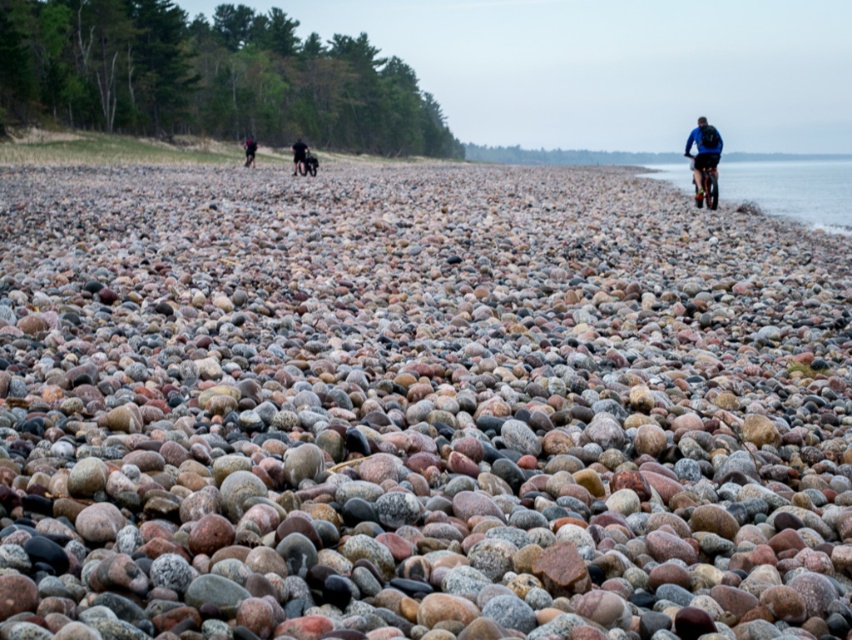
Question: Based on their relative distances, which object is farther from the speckled rock at center?

Choices:
 (A) blue fabric jacket at right
 (B) black fabric pants at center
 (C) dark blue fabric jacket at center

Answer: (B)

Question: Can you confirm if dark blue fabric jacket at center is positioned to the right of black fabric pants at center?

Choices:
 (A) no
 (B) yes

Answer: (B)

Question: Which object is the closest to the speckled rock at center?

Choices:
 (A) blue fabric jacket at right
 (B) black fabric pants at center

Answer: (A)

Question: Is speckled rock at center closer to camera compared to black fabric pants at center?

Choices:
 (A) no
 (B) yes

Answer: (B)

Question: Is speckled rock at center closer to the viewer compared to blue fabric jacket at right?

Choices:
 (A) no
 (B) yes

Answer: (B)

Question: Estimate the real-world distances between objects in this image. Which object is farther from the speckled rock at center?

Choices:
 (A) blue fabric jacket at right
 (B) dark blue fabric jacket at center
 (C) black fabric pants at center

Answer: (C)